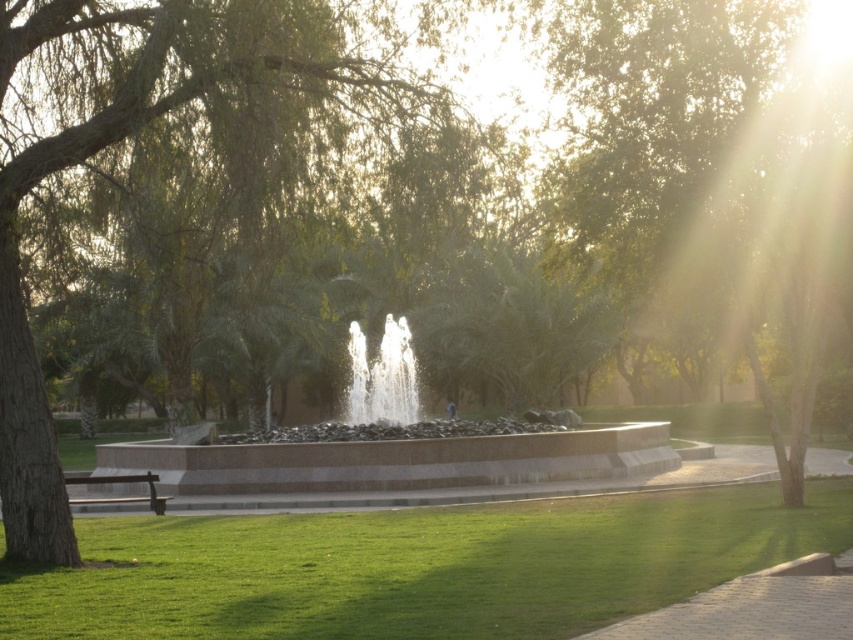
Question: Does clear glass water at center appear on the left side of brown wooden bench at lower left?

Choices:
 (A) no
 (B) yes

Answer: (A)

Question: Among these points, which one is nearest to the camera?

Choices:
 (A) [x=20, y=424]
 (B) [x=405, y=424]
 (C) [x=445, y=573]
 (D) [x=148, y=476]

Answer: (C)

Question: Can you confirm if green grass at lower center is smaller than clear glass water at center?

Choices:
 (A) no
 (B) yes

Answer: (B)

Question: Is green grass at lower center to the right of brown wooden bench at lower left from the viewer's perspective?

Choices:
 (A) no
 (B) yes

Answer: (B)

Question: Which object is farther from the camera taking this photo?

Choices:
 (A) brown wooden bench at lower left
 (B) clear glass water at center
 (C) green grass at lower center
 (D) green leafy tree at center

Answer: (B)

Question: Based on their relative distances, which object is nearer to the clear glass water at center?

Choices:
 (A) green grass at lower center
 (B) green leafy tree at center
 (C) brown wooden bench at lower left

Answer: (C)